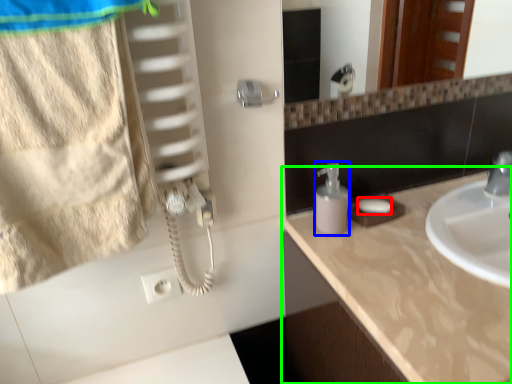
Question: Which is farther away from soap (highlighted by a red box)? soap dispenser (highlighted by a blue box) or countertop (highlighted by a green box)?

Choices:
 (A) soap dispenser
 (B) countertop

Answer: (B)